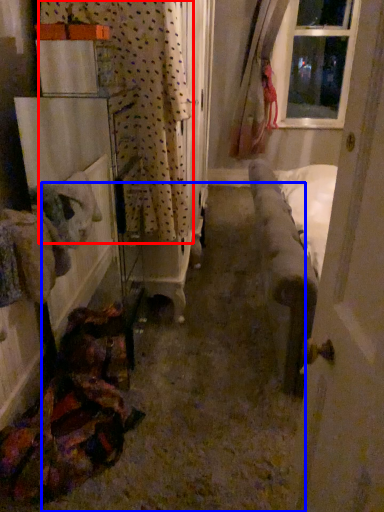
Question: Among these objects, which one is nearest to the camera, curtain (highlighted by a red box) or path (highlighted by a blue box)?

Choices:
 (A) curtain
 (B) path

Answer: (B)